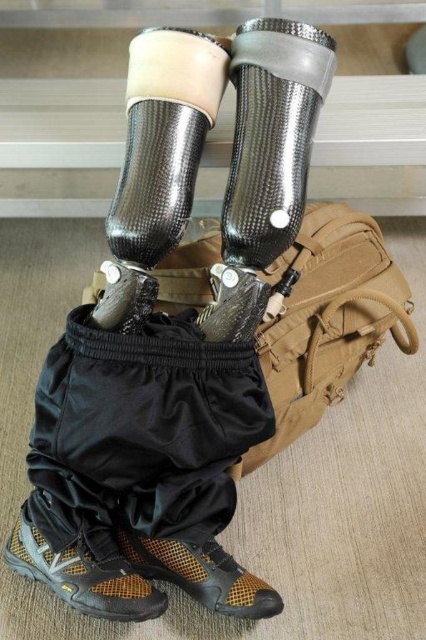
Question: Is textured brown shoe at lower left positioned in front of brown mesh shoe at lower left?

Choices:
 (A) no
 (B) yes

Answer: (B)

Question: Does textured brown shoe at lower left appear on the right side of brown mesh shoe at lower left?

Choices:
 (A) no
 (B) yes

Answer: (A)

Question: Which point is closer to the camera?

Choices:
 (A) textured brown shoe at lower left
 (B) carbon fiber boot at center
 (C) brown mesh shoe at lower left

Answer: (B)

Question: Which of the following is the farthest from the observer?

Choices:
 (A) brown mesh shoe at lower left
 (B) textured brown shoe at lower left

Answer: (A)

Question: Can you confirm if carbon fiber boot at center is bigger than brown mesh shoe at lower left?

Choices:
 (A) no
 (B) yes

Answer: (B)

Question: Which of these objects is positioned closest to the brown mesh shoe at lower left?

Choices:
 (A) textured brown shoe at lower left
 (B) carbon fiber boot at center

Answer: (A)